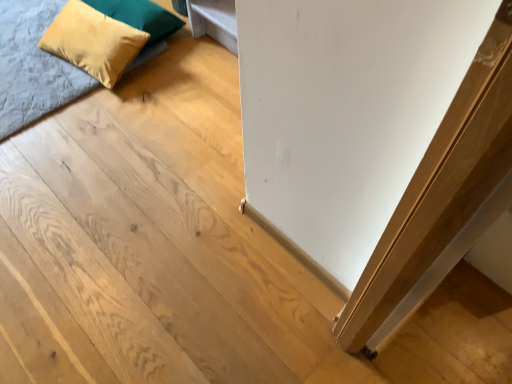
This screenshot has height=384, width=512. What do you see at coordinates (140, 16) in the screenshot?
I see `suede yellow pillow at upper left, which appears as the second pillow when ordered from the bottom` at bounding box center [140, 16].

The image size is (512, 384). I want to click on velvet yellow pillow at upper left, the 2th pillow from the top, so click(93, 41).

Does velvet blue bed at upper left come behind velvet yellow pillow at upper left, which is counted as the first pillow, starting from the bottom?

No, the depth of velvet blue bed at upper left is less than that of velvet yellow pillow at upper left, which is counted as the first pillow, starting from the bottom.

Find the location of `bed on the left of the velvet yellow pillow at upper left, which is counted as the first pillow, starting from the bottom`. bed on the left of the velvet yellow pillow at upper left, which is counted as the first pillow, starting from the bottom is located at coordinates (33, 66).

How many degrees apart are the facing directions of velvet blue bed at upper left and velvet yellow pillow at upper left, the 2th pillow from the top?

There is a 6.86-degree angle between the facing directions of velvet blue bed at upper left and velvet yellow pillow at upper left, the 2th pillow from the top.

Which object is wider, velvet blue bed at upper left or velvet yellow pillow at upper left, the 2th pillow from the top?

velvet blue bed at upper left.

Is velvet yellow pillow at upper left, the 2th pillow from the top, placed right next to suede yellow pillow at upper left, the 1th pillow viewed from the top?

No, velvet yellow pillow at upper left, the 2th pillow from the top, is not with suede yellow pillow at upper left, the 1th pillow viewed from the top.

Considering the sizes of velvet yellow pillow at upper left, which is counted as the first pillow, starting from the bottom, and suede yellow pillow at upper left, which appears as the second pillow when ordered from the bottom, in the image, is velvet yellow pillow at upper left, which is counted as the first pillow, starting from the bottom, wider or thinner than suede yellow pillow at upper left, which appears as the second pillow when ordered from the bottom,?

velvet yellow pillow at upper left, which is counted as the first pillow, starting from the bottom, is wider than suede yellow pillow at upper left, which appears as the second pillow when ordered from the bottom.

Is velvet yellow pillow at upper left, which is counted as the first pillow, starting from the bottom, to the right of velvet blue bed at upper left from the viewer's perspective?

Indeed, velvet yellow pillow at upper left, which is counted as the first pillow, starting from the bottom, is positioned on the right side of velvet blue bed at upper left.

From the image's perspective, is velvet yellow pillow at upper left, the 2th pillow from the top, below velvet blue bed at upper left?

Correct, velvet yellow pillow at upper left, the 2th pillow from the top, appears lower than velvet blue bed at upper left in the image.

Are velvet yellow pillow at upper left, the 2th pillow from the top, and velvet blue bed at upper left making contact?

velvet yellow pillow at upper left, the 2th pillow from the top, and velvet blue bed at upper left are clearly separated.

Which object is more forward, velvet yellow pillow at upper left, which is counted as the first pillow, starting from the bottom, or velvet blue bed at upper left?

velvet blue bed at upper left is in front.

Is velvet blue bed at upper left next to suede yellow pillow at upper left, which appears as the second pillow when ordered from the bottom?

No, velvet blue bed at upper left is not with suede yellow pillow at upper left, which appears as the second pillow when ordered from the bottom.

Is velvet blue bed at upper left not inside suede yellow pillow at upper left, which appears as the second pillow when ordered from the bottom?

Yes, velvet blue bed at upper left is outside of suede yellow pillow at upper left, which appears as the second pillow when ordered from the bottom.

Which object is more forward, velvet blue bed at upper left or suede yellow pillow at upper left, the 1th pillow viewed from the top?

Positioned in front is velvet blue bed at upper left.

Considering the sizes of objects velvet blue bed at upper left and suede yellow pillow at upper left, which appears as the second pillow when ordered from the bottom, in the image provided, who is taller, velvet blue bed at upper left or suede yellow pillow at upper left, which appears as the second pillow when ordered from the bottom,?

With more height is suede yellow pillow at upper left, which appears as the second pillow when ordered from the bottom.

Identify the location of pillow on the right of velvet yellow pillow at upper left, the 2th pillow from the top. (140, 16).

From the picture: Which point is more forward, (96,3) or (97,51)?

Point (97,51)

Are suede yellow pillow at upper left, which appears as the second pillow when ordered from the bottom, and velvet yellow pillow at upper left, the 2th pillow from the top, making contact?

suede yellow pillow at upper left, which appears as the second pillow when ordered from the bottom, is not next to velvet yellow pillow at upper left, the 2th pillow from the top, and they're not touching.

Looking at this image, how distant is suede yellow pillow at upper left, the 1th pillow viewed from the top, from velvet yellow pillow at upper left, the 2th pillow from the top?

A distance of 5.10 inches exists between suede yellow pillow at upper left, the 1th pillow viewed from the top, and velvet yellow pillow at upper left, the 2th pillow from the top.

Image resolution: width=512 pixels, height=384 pixels. What are the coordinates of `bed that appears in front of the suede yellow pillow at upper left, which appears as the second pillow when ordered from the bottom` in the screenshot? It's located at (33, 66).

Is velvet blue bed at upper left surrounded by suede yellow pillow at upper left, which appears as the second pillow when ordered from the bottom?

No, suede yellow pillow at upper left, which appears as the second pillow when ordered from the bottom, does not contain velvet blue bed at upper left.

Is suede yellow pillow at upper left, the 1th pillow viewed from the top, positioned with its back to velvet blue bed at upper left?

That's not correct — suede yellow pillow at upper left, the 1th pillow viewed from the top, is not looking away from velvet blue bed at upper left.

Where is `bed beneath the velvet yellow pillow at upper left, the 2th pillow from the top (from a real-world perspective)`? The height and width of the screenshot is (384, 512). bed beneath the velvet yellow pillow at upper left, the 2th pillow from the top (from a real-world perspective) is located at coordinates (33, 66).

You are a GUI agent. You are given a task and a screenshot of the screen. Output one action in this format:
    pyautogui.click(x=<x>, y=<y>)
    Task: Click on the pillow above the velvet yellow pillow at upper left, which is counted as the first pillow, starting from the bottom (from the image's perspective)
    The image size is (512, 384).
    Given the screenshot: What is the action you would take?
    (x=140, y=16)

Which object lies further to the anchor point velvet yellow pillow at upper left, the 2th pillow from the top, velvet blue bed at upper left or suede yellow pillow at upper left, the 1th pillow viewed from the top?

velvet blue bed at upper left is positioned further to the anchor velvet yellow pillow at upper left, the 2th pillow from the top.

Considering their positions, is suede yellow pillow at upper left, the 1th pillow viewed from the top, positioned closer to velvet blue bed at upper left than velvet yellow pillow at upper left, the 2th pillow from the top?

velvet yellow pillow at upper left, the 2th pillow from the top.

Which object lies nearer to the anchor point velvet yellow pillow at upper left, which is counted as the first pillow, starting from the bottom, suede yellow pillow at upper left, which appears as the second pillow when ordered from the bottom, or velvet blue bed at upper left?

suede yellow pillow at upper left, which appears as the second pillow when ordered from the bottom.

Considering their positions, is velvet blue bed at upper left positioned further to suede yellow pillow at upper left, which appears as the second pillow when ordered from the bottom, than velvet yellow pillow at upper left, which is counted as the first pillow, starting from the bottom?

The object further to suede yellow pillow at upper left, which appears as the second pillow when ordered from the bottom, is velvet blue bed at upper left.

Considering their positions, is velvet yellow pillow at upper left, the 2th pillow from the top, positioned further to suede yellow pillow at upper left, the 1th pillow viewed from the top, than velvet blue bed at upper left?

Based on the image, velvet blue bed at upper left appears to be further to suede yellow pillow at upper left, the 1th pillow viewed from the top.

From the image, which object appears to be nearer to velvet blue bed at upper left, velvet yellow pillow at upper left, which is counted as the first pillow, starting from the bottom, or suede yellow pillow at upper left, the 1th pillow viewed from the top?

velvet yellow pillow at upper left, which is counted as the first pillow, starting from the bottom, lies closer to velvet blue bed at upper left than the other object.

At what (x,y) coordinates should I click in order to perform the action: click on pillow located between velvet blue bed at upper left and suede yellow pillow at upper left, which appears as the second pillow when ordered from the bottom, in the left-right direction. Please return your answer as a coordinate pair (x, y). This screenshot has height=384, width=512. Looking at the image, I should click on (93, 41).